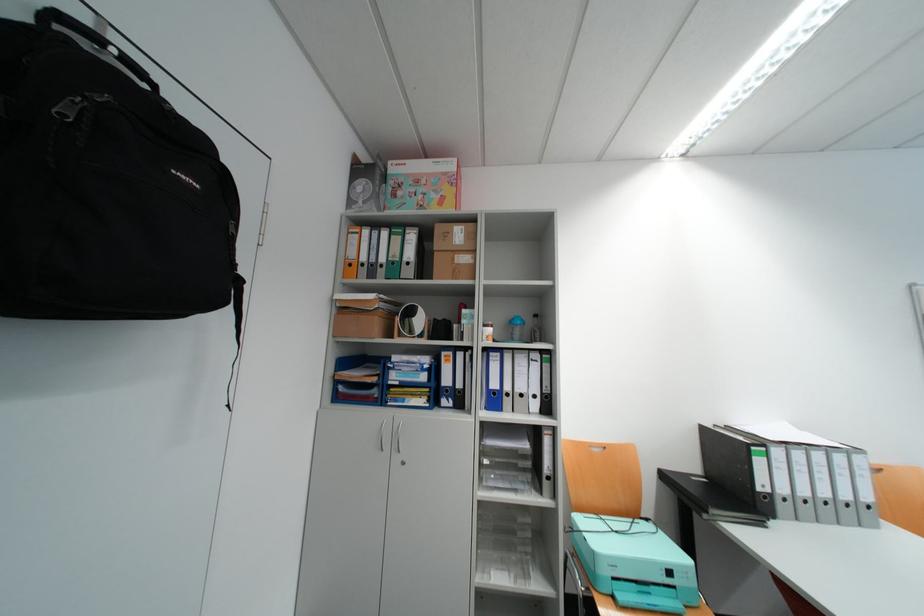
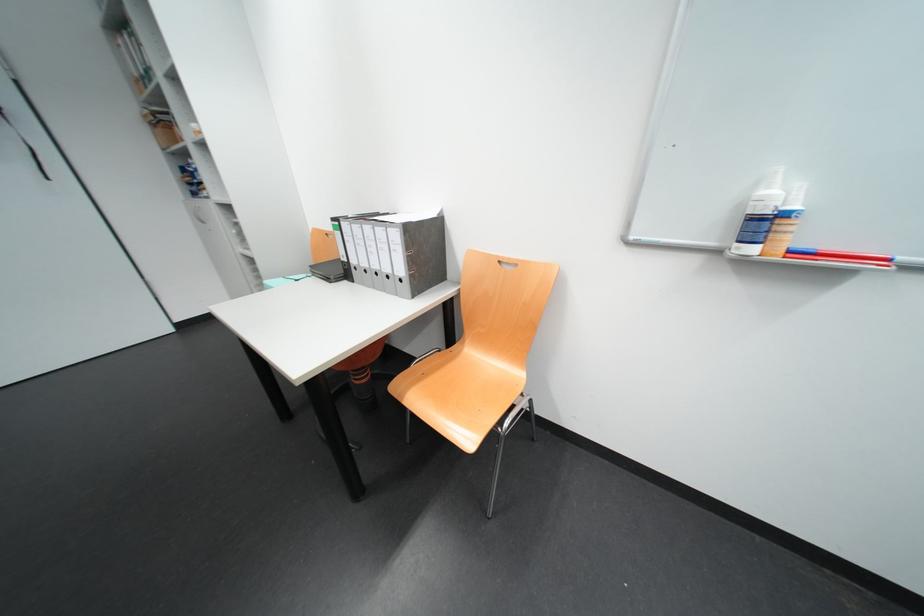
Question: I am providing you with two images of the same scene from different viewpoints. Please identify which objects are invisible in image2.

Choices:
 (A) white spray bottle
 (B) blue binder spine hole
 (C) gray ring binder
 (D) small golden handle

Answer: (B)